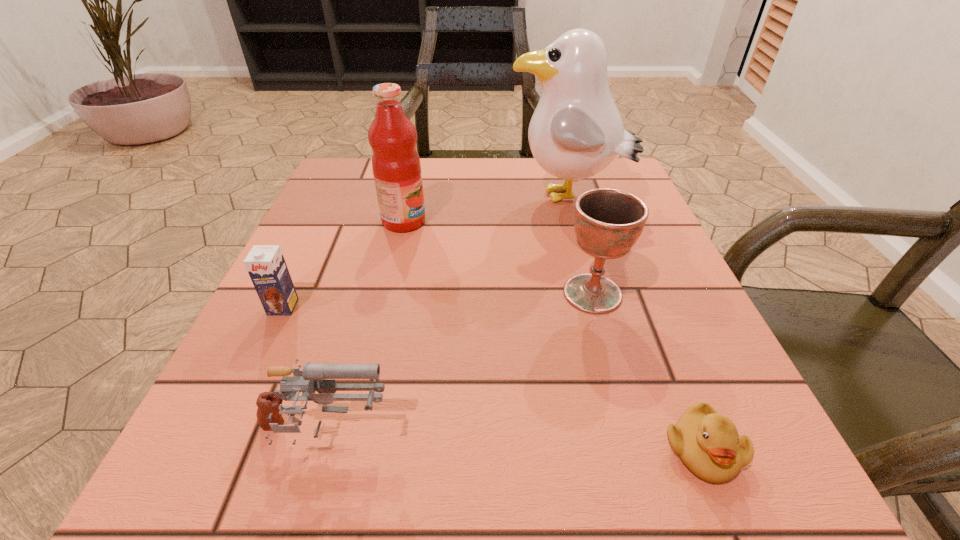
I want to click on empty location between the duckling and the tallest object, so click(635, 323).

Where is `object that stands as the fourth closest to the fourth shortest object`? object that stands as the fourth closest to the fourth shortest object is located at coordinates (269, 413).

Locate which object is the second closest to the gun. Please provide its 2D coordinates. Your answer should be formatted as a tuple, i.e. [(x, y)], where the tuple contains the x and y coordinates of a point satisfying the conditions above.

[(608, 222)]

Locate an element on the screen. This screenshot has width=960, height=540. vacant space that satisfies the following two spatial constraints: 1. on the front label of the second tallest object; 2. on the left side of the chalice is located at coordinates (387, 293).

Where is `vacant region that satisfies the following two spatial constraints: 1. on the beak of the tallest object; 2. on the front label of the chocolate milk`? This screenshot has width=960, height=540. vacant region that satisfies the following two spatial constraints: 1. on the beak of the tallest object; 2. on the front label of the chocolate milk is located at coordinates (598, 307).